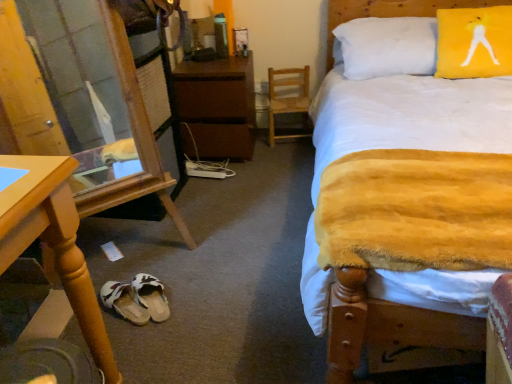
Find the location of a particular element. vacant area to the right of transparent glass door at lower left is located at coordinates (217, 256).